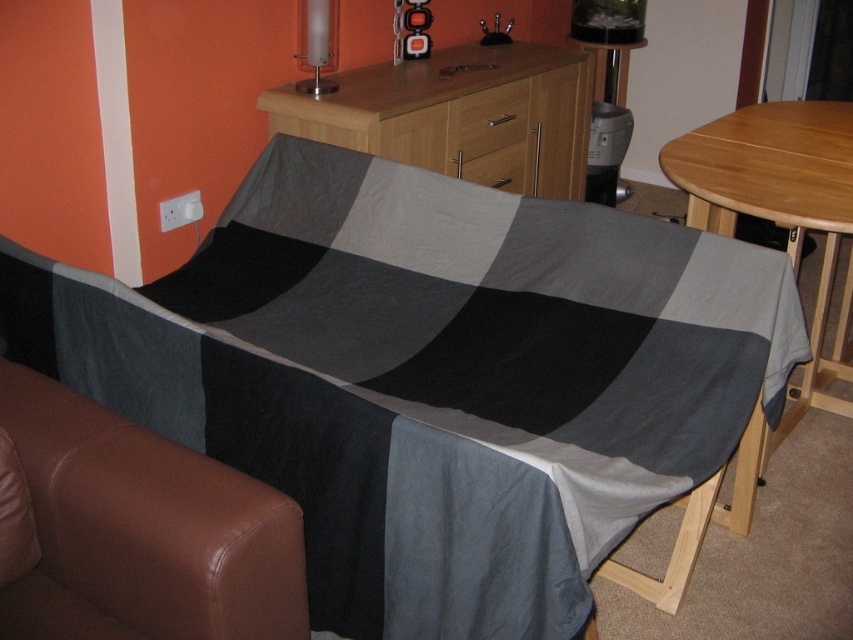
Question: Based on their relative distances, which object is nearer to the beech wood dresser at center?

Choices:
 (A) matte glass lampshade at upper center
 (B) brown leather armchair at lower left
 (C) matte wood drawer at center
 (D) wooden table at right

Answer: (C)

Question: Is textured cotton blanket at center below matte wood drawer at center?

Choices:
 (A) yes
 (B) no

Answer: (A)

Question: Which object is the farthest from the matte wood drawer at center?

Choices:
 (A) wooden table at right
 (B) textured cotton blanket at center

Answer: (B)

Question: Is wooden table at right smaller than matte glass lampshade at upper center?

Choices:
 (A) yes
 (B) no

Answer: (B)

Question: Does beech wood dresser at center come behind matte wood drawer at center?

Choices:
 (A) yes
 (B) no

Answer: (B)

Question: Which point is farther to the camera?

Choices:
 (A) (228, 582)
 (B) (775, 109)

Answer: (B)